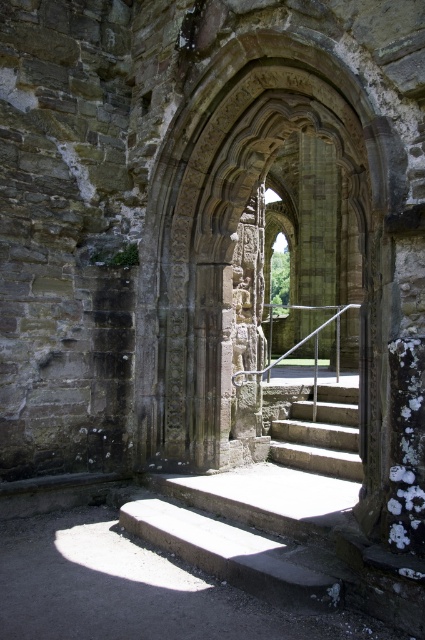
Question: Which object is farther from the camera taking this photo?

Choices:
 (A) smooth stone stairs at center
 (B) concrete steps at center
 (C) carved stone archway at center

Answer: (C)

Question: In this image, where is concrete steps at center located relative to smooth stone stairs at center?

Choices:
 (A) above
 (B) below

Answer: (B)

Question: Is concrete steps at center to the left of smooth stone stairs at center from the viewer's perspective?

Choices:
 (A) no
 (B) yes

Answer: (B)

Question: Is concrete steps at center behind smooth stone stairs at center?

Choices:
 (A) yes
 (B) no

Answer: (B)

Question: Which point is closer to the camera taking this photo?

Choices:
 (A) (306, 454)
 (B) (334, 480)
 (C) (226, 449)

Answer: (B)

Question: Which of the following is the closest to the observer?

Choices:
 (A) concrete steps at center
 (B) carved stone archway at center

Answer: (A)